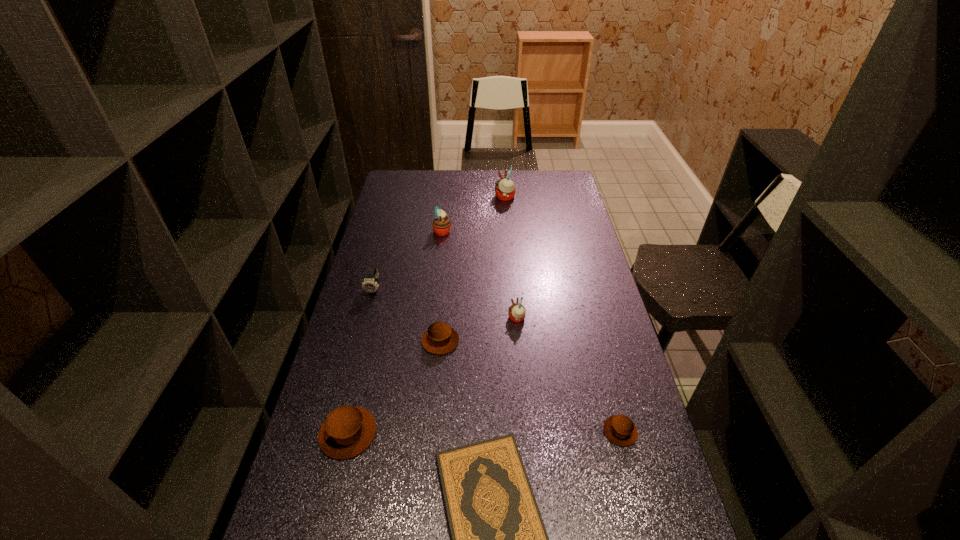
The width and height of the screenshot is (960, 540). Find the location of `the second biggest brown muffin`. the second biggest brown muffin is located at coordinates (440, 338).

Where is `the fourth farthest muffin`? This screenshot has height=540, width=960. the fourth farthest muffin is located at coordinates (440, 338).

The height and width of the screenshot is (540, 960). In order to click on the smallest brown muffin in this screenshot , I will do `click(619, 429)`.

Locate an element on the screen. The width and height of the screenshot is (960, 540). the rightmost muffin is located at coordinates (619, 429).

Identify the location of vacant space located 0.080m on the front-facing side of the biggest pink muffin. The height and width of the screenshot is (540, 960). (477, 197).

Locate an element on the screen. vacant space situated on the front-facing side of the biggest pink muffin is located at coordinates (458, 197).

You are a GUI agent. You are given a task and a screenshot of the screen. Output one action in this format:
    pyautogui.click(x=<x>, y=<y>)
    Task: Click on the blank space located on the front-facing side of the biggest pink muffin
    This screenshot has width=960, height=540.
    Given the screenshot: What is the action you would take?
    422,197

Locate an element on the screen. free space located on the front-facing side of the second tallest muffin is located at coordinates (517, 231).

This screenshot has height=540, width=960. In order to click on vacant space located 0.360m on the face of the dark watch in this screenshot , I will do `click(349, 383)`.

In order to click on blank space located 0.100m on the front-facing side of the third farthest muffin in this screenshot , I will do `click(478, 319)`.